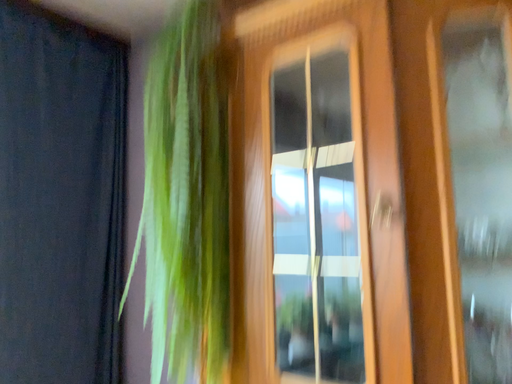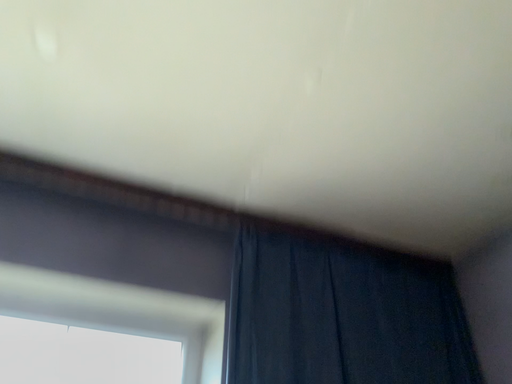
Question: How did the camera likely rotate when shooting the video?

Choices:
 (A) rotated downward
 (B) rotated upward

Answer: (B)